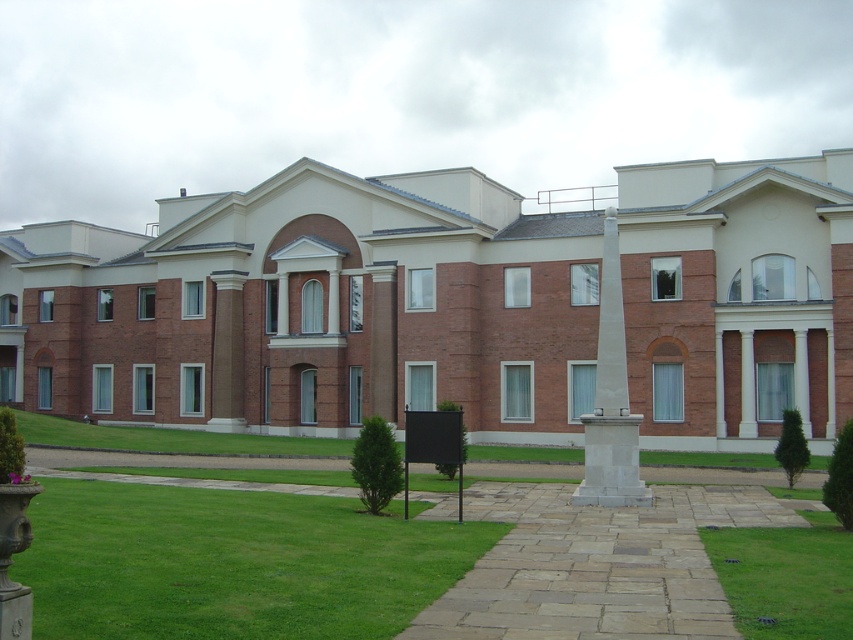
You are a gardener who needs to mow the lawn between the green grass at lower left and the green grass at center. Your lawnmower has a maximum reach of 5 meters. Can you mow the entire area between them without moving the lawnmower?

The distance between the green grass at lower left and the green grass at center is 6.30 meters, which exceeds the lawnmower maximum reach of 5 meters. Therefore, you cannot mow the entire area without moving the lawnmower.

You are standing in front of the building and see the green grass at center and the white marble obelisk at center. Which object is located higher up?

The white marble obelisk at center is higher up than the green grass at center because the green grass at center is below it.

You are a landscape architect designing a garden for this building. You notice there are two areas of green grass at lower left and green grass at center. Which grass area is wider?

The green grass at lower left is wider than the green grass at center.